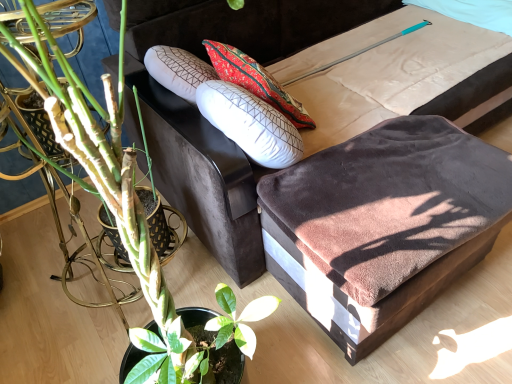
The width and height of the screenshot is (512, 384). Find the location of `brown suede ottoman at center`. brown suede ottoman at center is located at coordinates (296, 96).

Describe the element at coordinates (296, 96) in the screenshot. I see `brown suede ottoman at center` at that location.

Locate an element on the screen. This screenshot has width=512, height=384. brown suede ottoman at center is located at coordinates (296, 96).